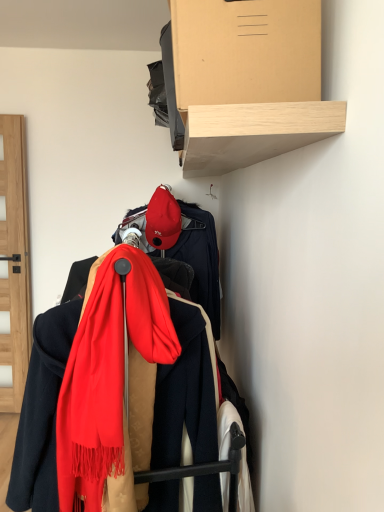
Describe the element at coordinates (112, 386) in the screenshot. The width and height of the screenshot is (384, 512). I see `red soft scarf at center` at that location.

Find the location of a particular element. This screenshot has width=384, height=512. red soft scarf at center is located at coordinates (112, 386).

Between matte red cap at center and red soft scarf at center, which one has larger width?

Wider between the two is red soft scarf at center.

How distant is matte red cap at center from red soft scarf at center?

31.86 inches.

From the image's perspective, is matte red cap at center located above red soft scarf at center?

Yes.

Which object is closer to the camera, matte red cap at center or red soft scarf at center?

red soft scarf at center is in front.

Could you tell me if red soft scarf at center is facing matte red cap at center?

No.

Considering the positions of point (59, 466) and point (157, 197), is point (59, 466) closer or farther from the camera than point (157, 197)?

Point (59, 466) is positioned closer to the camera compared to point (157, 197).

Consider the image. Is red soft scarf at center located outside matte red cap at center?

That's correct, red soft scarf at center is outside of matte red cap at center.

In the scene shown: Between red soft scarf at center and matte red cap at center, which one has smaller size?

matte red cap at center.

Is matte red cap at center completely or partially outside of light brown wooden shelf at upper center?

Indeed, matte red cap at center is completely outside light brown wooden shelf at upper center.

Does matte red cap at center turn towards light brown wooden shelf at upper center?

No.

Which is farther from the camera, (154, 199) or (245, 12)?

The point (154, 199) is farther from the camera.

Is point (195, 21) farther from viewer compared to point (103, 254)?

No, (195, 21) is in front of (103, 254).

Measure the distance between light brown wooden shelf at upper center and red soft scarf at center.

The distance of light brown wooden shelf at upper center from red soft scarf at center is 21.45 inches.

Considering the relative sizes of light brown wooden shelf at upper center and red soft scarf at center in the image provided, is light brown wooden shelf at upper center thinner than red soft scarf at center?

Yes.

Is light brown wooden shelf at upper center at the left side of red soft scarf at center?

No.

Consider the image. Is red soft scarf at center not within light brown wooden shelf at upper center?

Absolutely, red soft scarf at center is external to light brown wooden shelf at upper center.

How many degrees apart are the facing directions of red soft scarf at center and light brown wooden shelf at upper center?

There is a 5.01-degree angle between the facing directions of red soft scarf at center and light brown wooden shelf at upper center.

From a real-world perspective, relative to light brown wooden shelf at upper center, is red soft scarf at center vertically above or below?

In terms of real-world spatial position, red soft scarf at center is below light brown wooden shelf at upper center.

Considering the sizes of red soft scarf at center and light brown wooden shelf at upper center in the image, is red soft scarf at center wider or thinner than light brown wooden shelf at upper center?

red soft scarf at center is wider than light brown wooden shelf at upper center.

What's the angular difference between light brown wooden shelf at upper center and matte red cap at center's facing directions?

The angular difference between light brown wooden shelf at upper center and matte red cap at center is 5.01 degrees.

From a real-world perspective, is light brown wooden shelf at upper center positioned above or below matte red cap at center?

From a real-world perspective, light brown wooden shelf at upper center is physically above matte red cap at center.

Is light brown wooden shelf at upper center next to matte red cap at center and touching it?

No, light brown wooden shelf at upper center is not beside matte red cap at center.

Considering the points (278, 79) and (174, 236), which point is behind, point (278, 79) or point (174, 236)?

The point (174, 236) is more distant.

Find the location of `scarf below the matte red cap at center (from a real-world perspective)`. scarf below the matte red cap at center (from a real-world perspective) is located at coordinates (112, 386).

Image resolution: width=384 pixels, height=512 pixels. Find the location of `hat that appears behind the red soft scarf at center`. hat that appears behind the red soft scarf at center is located at coordinates (163, 219).

From the image, which object appears to be nearer to matte red cap at center, red soft scarf at center or light brown wooden shelf at upper center?

Among the two, light brown wooden shelf at upper center is located nearer to matte red cap at center.

Which object lies nearer to the anchor point red soft scarf at center, matte red cap at center or light brown wooden shelf at upper center?

light brown wooden shelf at upper center lies closer to red soft scarf at center than the other object.

From the image, which object appears to be nearer to light brown wooden shelf at upper center, red soft scarf at center or matte red cap at center?

Based on the image, red soft scarf at center appears to be nearer to light brown wooden shelf at upper center.

From the image, which object appears to be farther from matte red cap at center, light brown wooden shelf at upper center or red soft scarf at center?

Based on the image, red soft scarf at center appears to be further to matte red cap at center.

Estimate the real-world distances between objects in this image. Which object is closer to light brown wooden shelf at upper center, matte red cap at center or red soft scarf at center?

red soft scarf at center is positioned closer to the anchor light brown wooden shelf at upper center.

Based on their spatial positions, is light brown wooden shelf at upper center or matte red cap at center closer to red soft scarf at center?

light brown wooden shelf at upper center.

Where is `scarf positioned between light brown wooden shelf at upper center and matte red cap at center from near to far`? The width and height of the screenshot is (384, 512). scarf positioned between light brown wooden shelf at upper center and matte red cap at center from near to far is located at coordinates point(112,386).